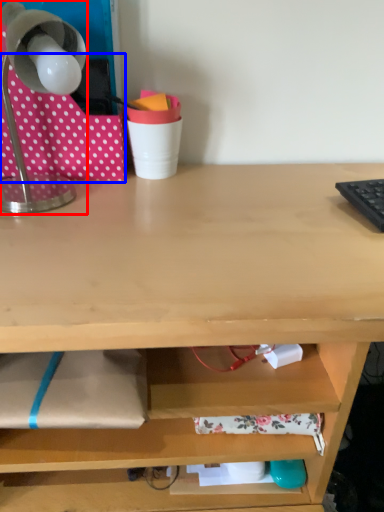
Question: Which object appears farthest to the camera in this image, lamp (highlighted by a red box) or fabric (highlighted by a blue box)?

Choices:
 (A) lamp
 (B) fabric

Answer: (B)